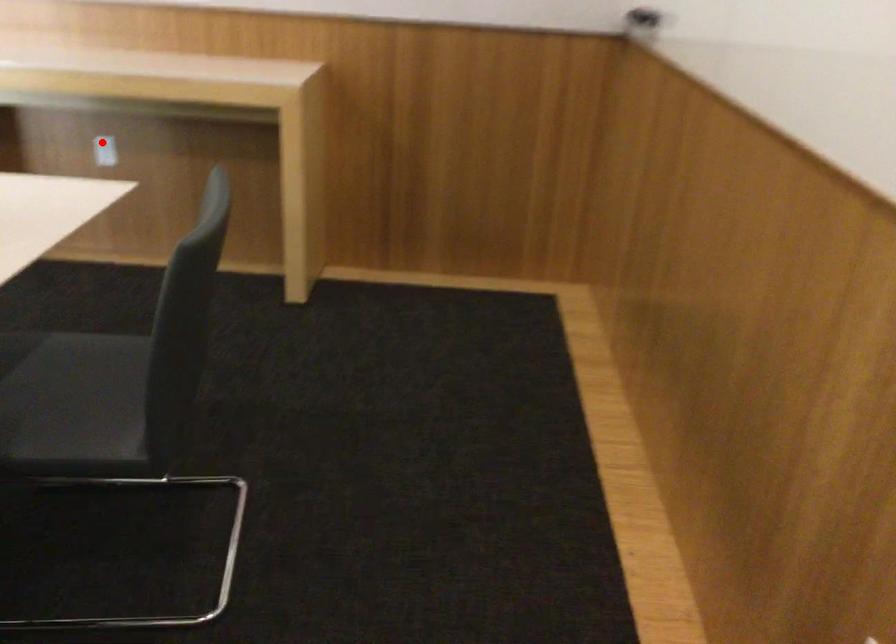
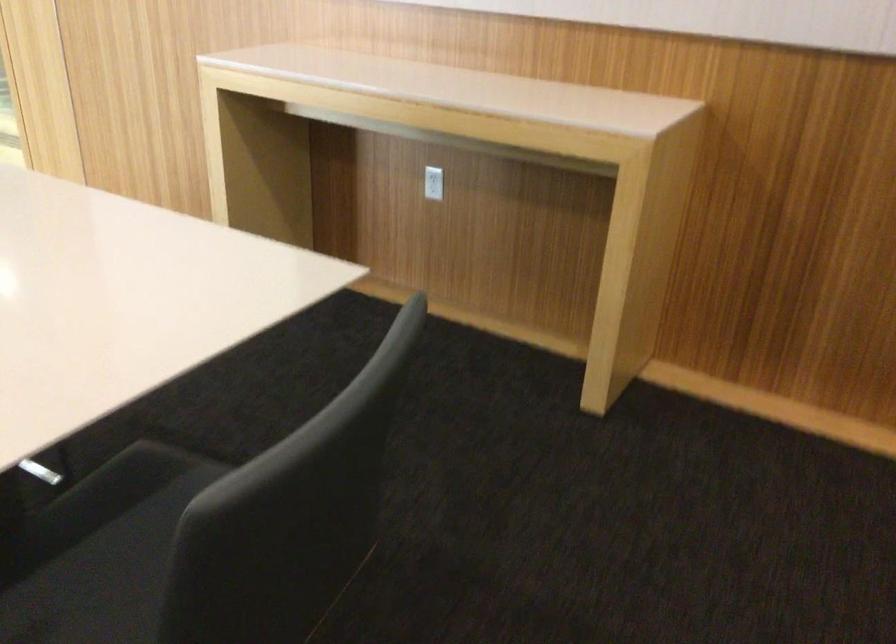
Locate, in the second image, the point that corresponds to the highlighted location in the first image.

(433, 183)